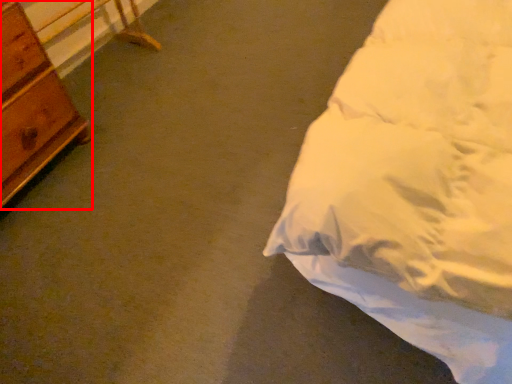
Question: Where is chest of drawers (annotated by the red box) located in relation to table in the image?

Choices:
 (A) left
 (B) right

Answer: (A)